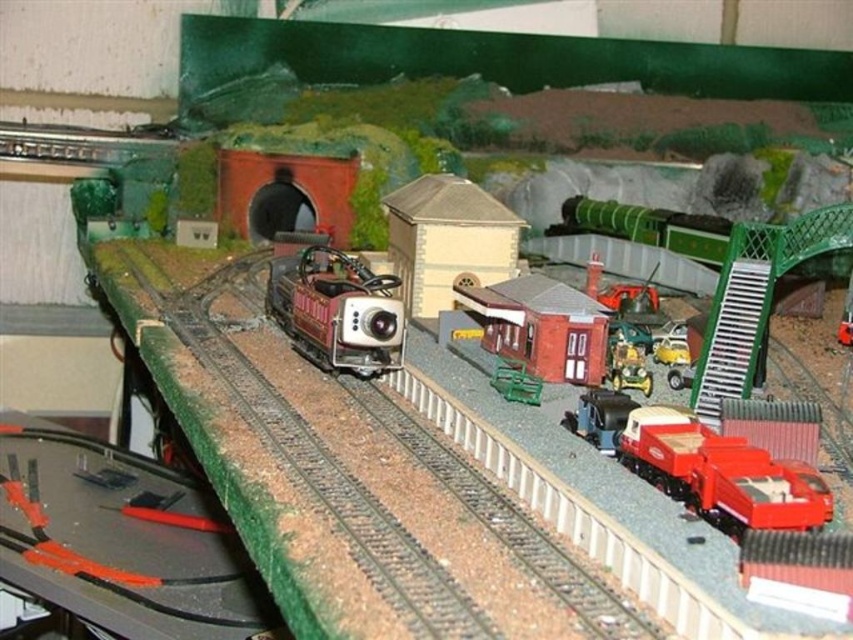
You are a model train enthusiast examining the layout. You need to place a new miniature car between the metallic red truck at lower right and the green plastic bench at center. Based on their positions, which object should the car be closer to?

The metallic red truck at lower right is closer to the viewer than the green plastic bench at center, so the new miniature car should be placed closer to the metallic red truck at lower right to maintain the layout depth.